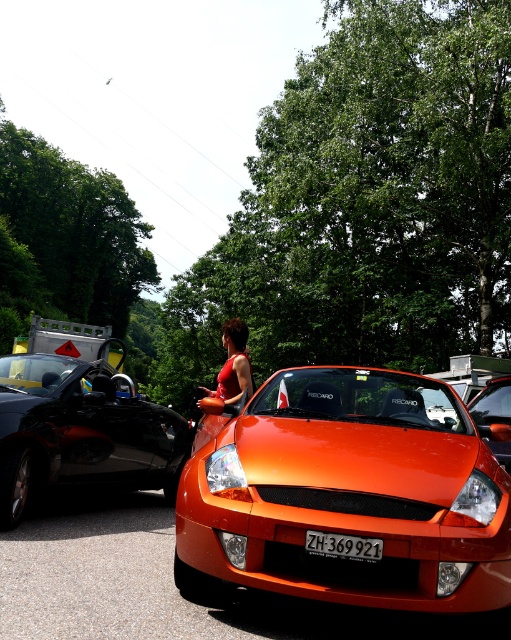
Does point (501, 419) lie behind point (368, 541)?

Yes, it is.

What do you see at coordinates (492, 403) in the screenshot?
I see `orange matte sports car at center` at bounding box center [492, 403].

Find the location of a particular element. orange matte sports car at center is located at coordinates (492, 403).

You are a GUI agent. You are given a task and a screenshot of the screen. Output one action in this format:
    pyautogui.click(x=<x>, y=<y>)
    Task: Click on the orange matte sports car at center
    
    Given the screenshot: What is the action you would take?
    pyautogui.click(x=492, y=403)

Between point (248, 413) and point (236, 381), which one is positioned behind?

Positioned behind is point (236, 381).

Which is more to the right, orange glossy sports car at center or matte red dress at center?

Positioned to the right is orange glossy sports car at center.

Identify the location of orange glossy sports car at center. (347, 496).

This screenshot has width=511, height=640. In order to click on orange glossy sports car at center in this screenshot , I will do `click(347, 496)`.

Does orange glossy sports car at center appear on the left side of orange glossy car at center?

Incorrect, orange glossy sports car at center is not on the left side of orange glossy car at center.

Between orange glossy sports car at center and orange glossy car at center, which one has less height?

orange glossy car at center is shorter.

Does point (476, 536) lie in front of point (237, 616)?

Yes, it is in front of point (237, 616).

You are a GUI agent. You are given a task and a screenshot of the screen. Output one action in this format:
    pyautogui.click(x=<x>, y=<y>)
    Task: Click on the orange glossy sports car at center
    The width and height of the screenshot is (511, 640).
    Given the screenshot: What is the action you would take?
    pyautogui.click(x=347, y=496)